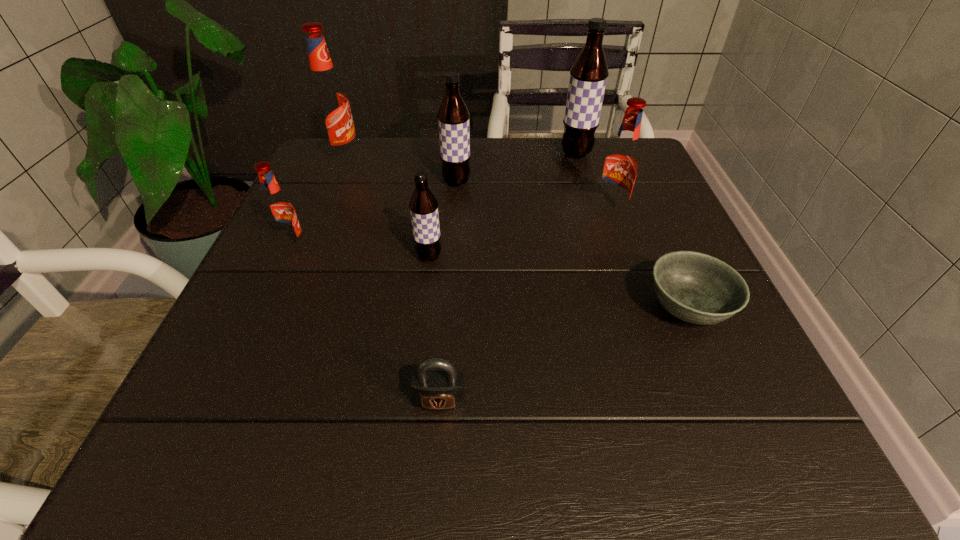
You are a GUI agent. You are given a task and a screenshot of the screen. Output one action in this format:
    pyautogui.click(x=<x>, y=<y>)
    Task: Click on the free space between the smallest brown root beer and the second nearest brown root beer
    The image size is (960, 540).
    Given the screenshot: What is the action you would take?
    pyautogui.click(x=443, y=219)

Identify which object is located as the second nearest to the farthest red root beer. Please provide its 2D coordinates. Your answer should be formatted as a tuple, i.e. [(x, y)], where the tuple contains the x and y coordinates of a point satisfying the conditions above.

[(279, 211)]

You are a GUI agent. You are given a task and a screenshot of the screen. Output one action in this format:
    pyautogui.click(x=<x>, y=<y>)
    Task: Click on the object that is the third nearest to the seventh farthest object
    This screenshot has height=540, width=960.
    Given the screenshot: What is the action you would take?
    pyautogui.click(x=423, y=205)

Locate which root beer ranks fourth in proximity to the third farthest root beer. Please provide its 2D coordinates. Your answer should be formatted as a tuple, i.e. [(x, y)], where the tuple contains the x and y coordinates of a point satisfying the conditions above.

[(621, 163)]

You are a GUI agent. You are given a task and a screenshot of the screen. Output one action in this format:
    pyautogui.click(x=<x>, y=<y>)
    Task: Click on the root beer that stands as the closest to the nearest brown root beer
    This screenshot has height=540, width=960.
    Given the screenshot: What is the action you would take?
    pyautogui.click(x=453, y=116)

Identify which brown root beer is located as the third nearest to the nearest object. Please provide its 2D coordinates. Your answer should be formatted as a tuple, i.e. [(x, y)], where the tuple contains the x and y coordinates of a point satisfying the conditions above.

[(588, 76)]

Where is `brown root beer that is the closest to the farthest brown root beer`? The image size is (960, 540). brown root beer that is the closest to the farthest brown root beer is located at coordinates (453, 116).

Find the location of `the closest red root beer to the second biggest red root beer`. the closest red root beer to the second biggest red root beer is located at coordinates (329, 101).

Point out which red root beer is positioned as the second nearest to the shortest object. Please provide its 2D coordinates. Your answer should be formatted as a tuple, i.e. [(x, y)], where the tuple contains the x and y coordinates of a point satisfying the conditions above.

[(279, 211)]

At what (x,y) coordinates should I click in order to perform the action: click on vacant space that satisfies the following two spatial constraints: 1. on the front side of the farthest red root beer; 2. on the left side of the nearest brown root beer. Please return your answer as a coordinate pair (x, y). The height and width of the screenshot is (540, 960). Looking at the image, I should click on (302, 256).